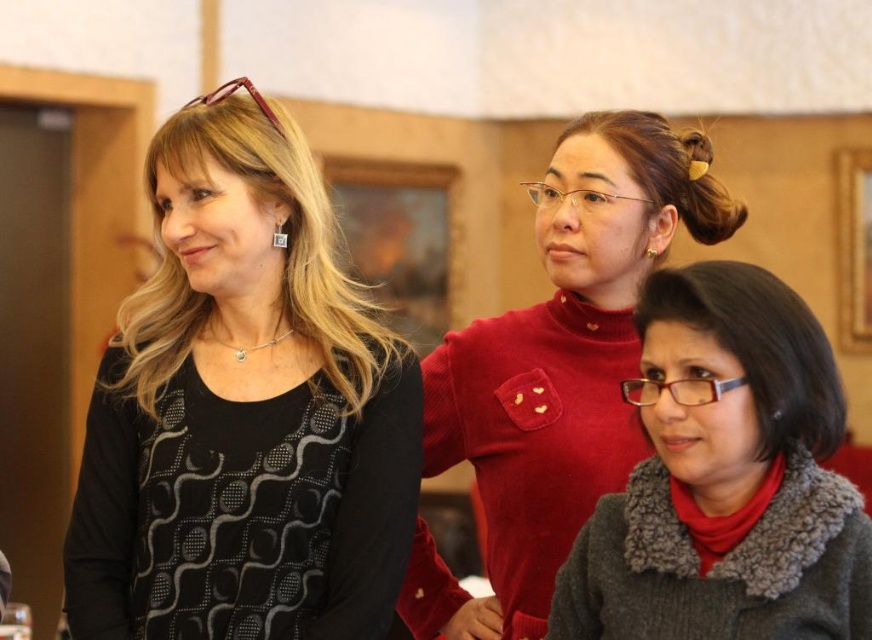
You are a photographer adjusting your camera settings. You notice the matte red sweater at center and the silver metallic square earring at upper left. Which object should you focus on first if you want to capture both in sharp focus?

You should focus on the matte red sweater at center first because it is closer to the viewer than the silver metallic square earring at upper left, ensuring both will be in focus when using a shallow depth of field.